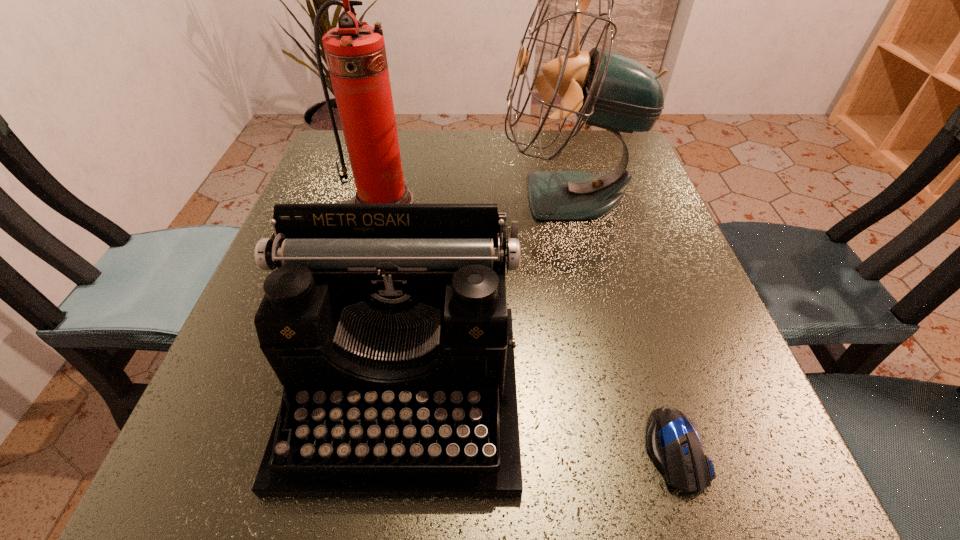
I want to click on fan, so click(604, 88).

At what (x,y) coordinates should I click in order to perform the action: click on fire extinguisher. Please return your answer as a coordinate pair (x, y). This screenshot has width=960, height=540. Looking at the image, I should click on (355, 52).

This screenshot has width=960, height=540. Identify the location of the second shortest object. (387, 325).

Find the location of a particular element. This screenshot has height=540, width=960. computer mouse is located at coordinates (673, 442).

Where is `free space located on the front-facing side of the fan for air flow`? This screenshot has height=540, width=960. free space located on the front-facing side of the fan for air flow is located at coordinates (350, 197).

At what (x,y) coordinates should I click in order to perform the action: click on vacant space located on the front-facing side of the fan for air flow. Please return your answer as a coordinate pair (x, y). This screenshot has height=540, width=960. Looking at the image, I should click on (455, 197).

At what (x,y) coordinates should I click in order to perform the action: click on free space located 0.320m on the front-facing side of the fan for air flow. Please return your answer as a coordinate pair (x, y). Looking at the image, I should click on click(350, 197).

In order to click on vacant space positioned at the discharge end of the fire extinguisher in this screenshot , I will do `click(370, 255)`.

Locate an element on the screen. This screenshot has height=540, width=960. object that is at the far edge is located at coordinates (604, 88).

Locate an element on the screen. The width and height of the screenshot is (960, 540). typewriter present at the near edge is located at coordinates (387, 325).